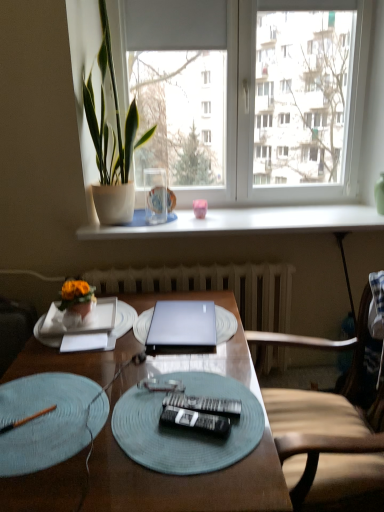
Locate an element on the screen. The width and height of the screenshot is (384, 512). vacant point above silver metallic laptop at center (from a real-world perspective) is located at coordinates (185, 316).